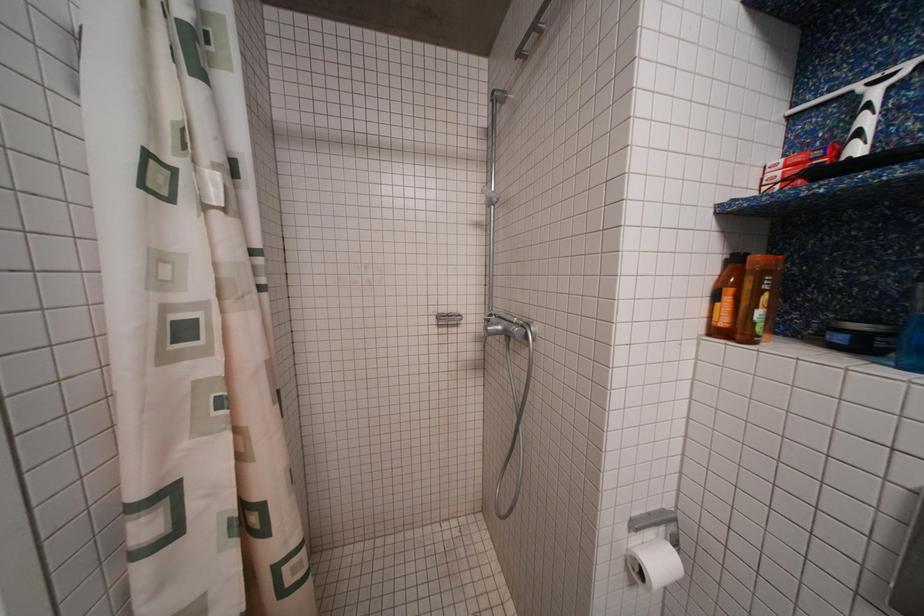
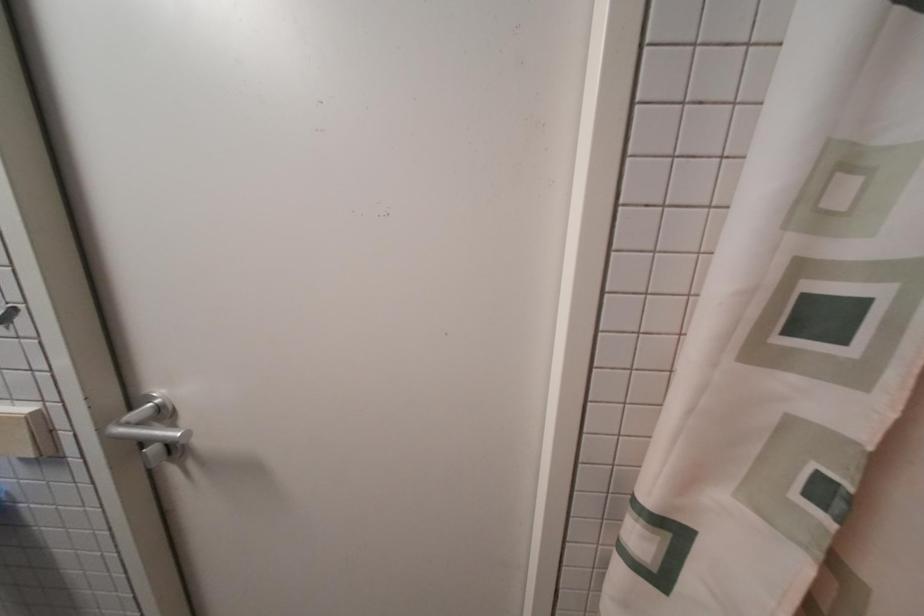
Question: Based on the continuous images, in which direction is the camera rotating? Reply with the corresponding letter.

Choices:
 (A) Left
 (B) Right
 (C) Up
 (D) Down

Answer: (A)